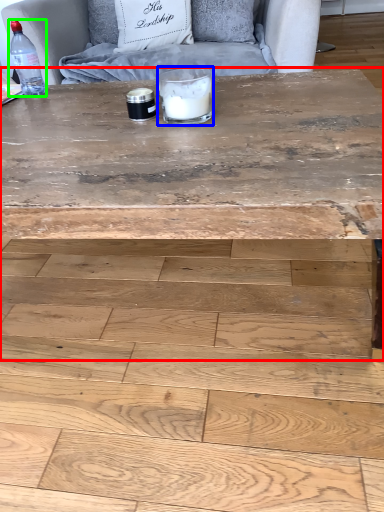
Question: Based on their relative distances, which object is nearer to coffee table (highlighted by a red box)? Choose from candle holder (highlighted by a blue box) and bottle (highlighted by a green box).

Choices:
 (A) candle holder
 (B) bottle

Answer: (A)